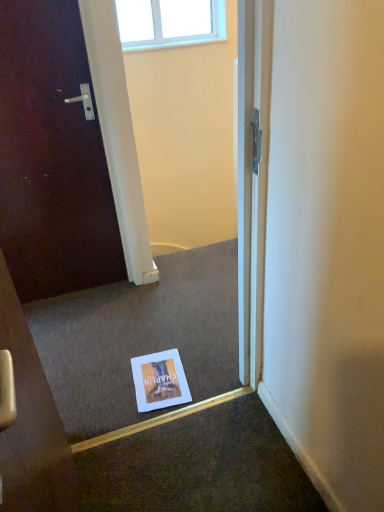
Question: Does white paper flyer at center come in front of clear glass window at upper center?

Choices:
 (A) no
 (B) yes

Answer: (B)

Question: Does white paper flyer at center have a greater width compared to clear glass window at upper center?

Choices:
 (A) yes
 (B) no

Answer: (A)

Question: Considering the relative sizes of white paper flyer at center and clear glass window at upper center in the image provided, is white paper flyer at center taller than clear glass window at upper center?

Choices:
 (A) yes
 (B) no

Answer: (B)

Question: From the image's perspective, is white paper flyer at center under clear glass window at upper center?

Choices:
 (A) no
 (B) yes

Answer: (B)

Question: Does white paper flyer at center turn towards clear glass window at upper center?

Choices:
 (A) yes
 (B) no

Answer: (B)

Question: Considering the relative positions of white paper flyer at center and clear glass window at upper center in the image provided, is white paper flyer at center to the right of clear glass window at upper center from the viewer's perspective?

Choices:
 (A) yes
 (B) no

Answer: (A)

Question: From a real-world perspective, is clear glass window at upper center beneath white paper flyer at center?

Choices:
 (A) yes
 (B) no

Answer: (B)

Question: Is clear glass window at upper center positioned with its back to white paper flyer at center?

Choices:
 (A) yes
 (B) no

Answer: (B)

Question: From a real-world perspective, is clear glass window at upper center on top of white paper flyer at center?

Choices:
 (A) no
 (B) yes

Answer: (B)

Question: From the image's perspective, does clear glass window at upper center appear lower than white paper flyer at center?

Choices:
 (A) no
 (B) yes

Answer: (A)

Question: Considering the relative sizes of clear glass window at upper center and white paper flyer at center in the image provided, is clear glass window at upper center shorter than white paper flyer at center?

Choices:
 (A) no
 (B) yes

Answer: (A)

Question: Is clear glass window at upper center beside white paper flyer at center?

Choices:
 (A) yes
 (B) no

Answer: (B)

Question: From a real-world perspective, is clear glass window at upper center positioned above or below white paper flyer at center?

Choices:
 (A) below
 (B) above

Answer: (B)